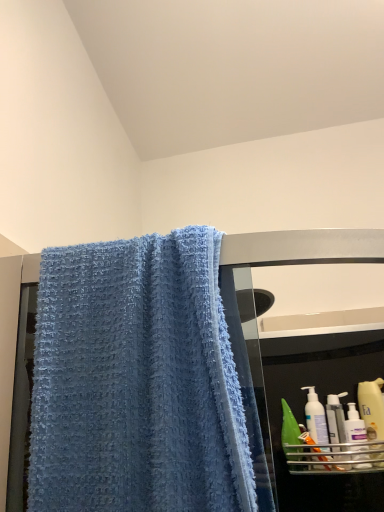
Question: Is white plastic bottle at right, arranged as the second mouthwash when viewed from the left, behind white plastic pump bottle at right, acting as the 1th cleaning product starting from the left?

Choices:
 (A) no
 (B) yes

Answer: (A)

Question: Is white plastic bottle at right, placed as the first mouthwash when sorted from right to left, placed right next to white plastic pump bottle at right, arranged as the third cleaning product when viewed from the right?

Choices:
 (A) no
 (B) yes

Answer: (B)

Question: From a real-world perspective, is white plastic bottle at right, placed as the first mouthwash when sorted from right to left, positioned under white plastic pump bottle at right, acting as the 1th cleaning product starting from the left, based on gravity?

Choices:
 (A) yes
 (B) no

Answer: (A)

Question: Is white plastic bottle at right, arranged as the second mouthwash when viewed from the left, wider than white plastic pump bottle at right, acting as the 1th cleaning product starting from the left?

Choices:
 (A) no
 (B) yes

Answer: (A)

Question: From the image's perspective, is white plastic bottle at right, placed as the first mouthwash when sorted from right to left, located above white plastic pump bottle at right, arranged as the third cleaning product when viewed from the right?

Choices:
 (A) yes
 (B) no

Answer: (B)

Question: In terms of size, does white plastic bottle at right, placed as the first mouthwash when sorted from right to left, appear bigger or smaller than white plastic bottle at lower right, marked as the second cleaning product in a left-to-right arrangement?

Choices:
 (A) small
 (B) big

Answer: (A)

Question: Does point (329, 439) appear closer or farther from the camera than point (344, 428)?

Choices:
 (A) closer
 (B) farther

Answer: (A)

Question: Is white plastic bottle at right, placed as the first mouthwash when sorted from right to left, to the left or to the right of white plastic bottle at lower right, the second cleaning product when ordered from right to left, in the image?

Choices:
 (A) right
 (B) left

Answer: (B)

Question: In terms of width, does white plastic bottle at right, placed as the first mouthwash when sorted from right to left, look wider or thinner when compared to white plastic bottle at lower right, marked as the second cleaning product in a left-to-right arrangement?

Choices:
 (A) wide
 (B) thin

Answer: (B)

Question: Considering the relative positions of white plastic bottle at right, placed as the first mouthwash when sorted from right to left, and blue textured towel at upper left in the image provided, is white plastic bottle at right, placed as the first mouthwash when sorted from right to left, to the left or to the right of blue textured towel at upper left?

Choices:
 (A) right
 (B) left

Answer: (A)

Question: From a real-world perspective, relative to blue textured towel at upper left, is white plastic bottle at right, placed as the first mouthwash when sorted from right to left, vertically above or below?

Choices:
 (A) below
 (B) above

Answer: (A)

Question: Considering their positions, is white plastic bottle at right, arranged as the second mouthwash when viewed from the left, located in front of or behind blue textured towel at upper left?

Choices:
 (A) front
 (B) behind

Answer: (B)

Question: In terms of size, does white plastic bottle at right, placed as the first mouthwash when sorted from right to left, appear bigger or smaller than blue textured towel at upper left?

Choices:
 (A) small
 (B) big

Answer: (A)

Question: Considering the positions of blue textured towel at upper left and white plastic pump bottle at right, arranged as the third cleaning product when viewed from the right, in the image, is blue textured towel at upper left taller or shorter than white plastic pump bottle at right, arranged as the third cleaning product when viewed from the right,?

Choices:
 (A) tall
 (B) short

Answer: (A)

Question: Is blue textured towel at upper left bigger or smaller than white plastic pump bottle at right, arranged as the third cleaning product when viewed from the right?

Choices:
 (A) small
 (B) big

Answer: (B)